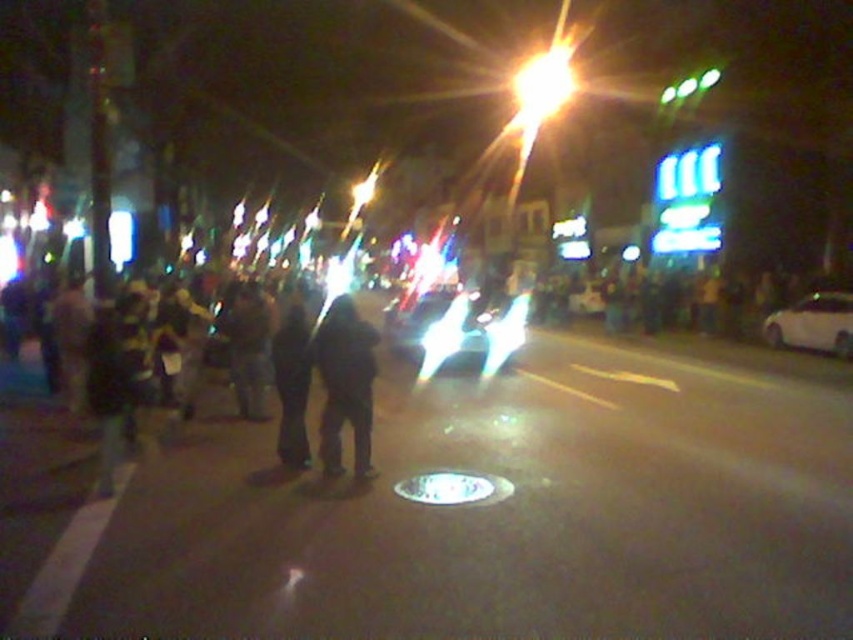
Can you confirm if black matte jacket at center is positioned to the left of dark fabric pants at center?

Incorrect, black matte jacket at center is not on the left side of dark fabric pants at center.

You are a GUI agent. You are given a task and a screenshot of the screen. Output one action in this format:
    pyautogui.click(x=<x>, y=<y>)
    Task: Click on the black matte jacket at center
    
    Given the screenshot: What is the action you would take?
    pyautogui.click(x=345, y=385)

You are a GUI agent. You are given a task and a screenshot of the screen. Output one action in this format:
    pyautogui.click(x=<x>, y=<y>)
    Task: Click on the black matte jacket at center
    Image resolution: width=853 pixels, height=640 pixels.
    Given the screenshot: What is the action you would take?
    pyautogui.click(x=345, y=385)

Is the position of black matte crowd at left less distant than that of shiny silver car at center?

That is True.

Is black matte crowd at left further to the viewer compared to shiny silver car at center?

That is False.

Measure the distance between black matte crowd at left and camera.

The distance of black matte crowd at left from camera is 7.33 meters.

Where is `black matte crowd at left`? black matte crowd at left is located at coordinates (41, 440).

Is shiny silver car at center behind black matte jacket at center?

Yes, shiny silver car at center is behind black matte jacket at center.

Does shiny silver car at center appear over black matte jacket at center?

Yes, shiny silver car at center is above black matte jacket at center.

At what (x,y) coordinates should I click in order to perform the action: click on shiny silver car at center. Please return your answer as a coordinate pair (x, y). This screenshot has width=853, height=640. Looking at the image, I should click on [457, 326].